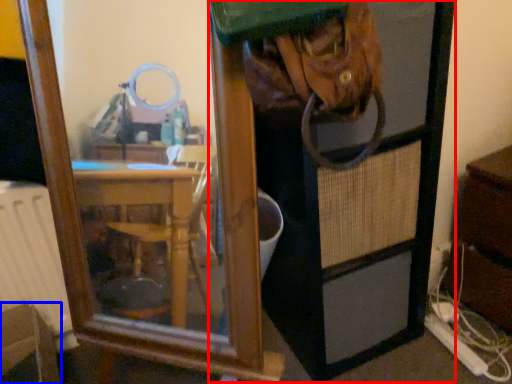
Question: Which object appears farthest to the camera in this image, screen door (highlighted by a red box) or furniture (highlighted by a blue box)?

Choices:
 (A) screen door
 (B) furniture

Answer: (B)